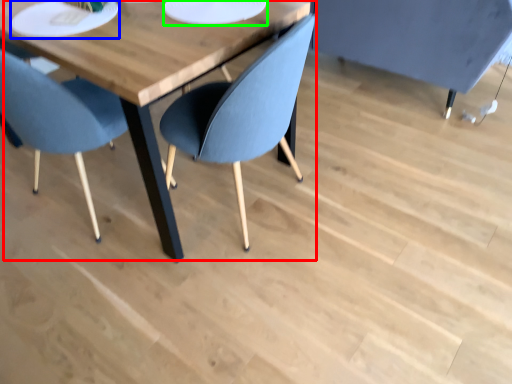
Question: Which is farther away from table (highlighted by a red box)? platter (highlighted by a blue box) or paper plate (highlighted by a green box)?

Choices:
 (A) platter
 (B) paper plate

Answer: (B)